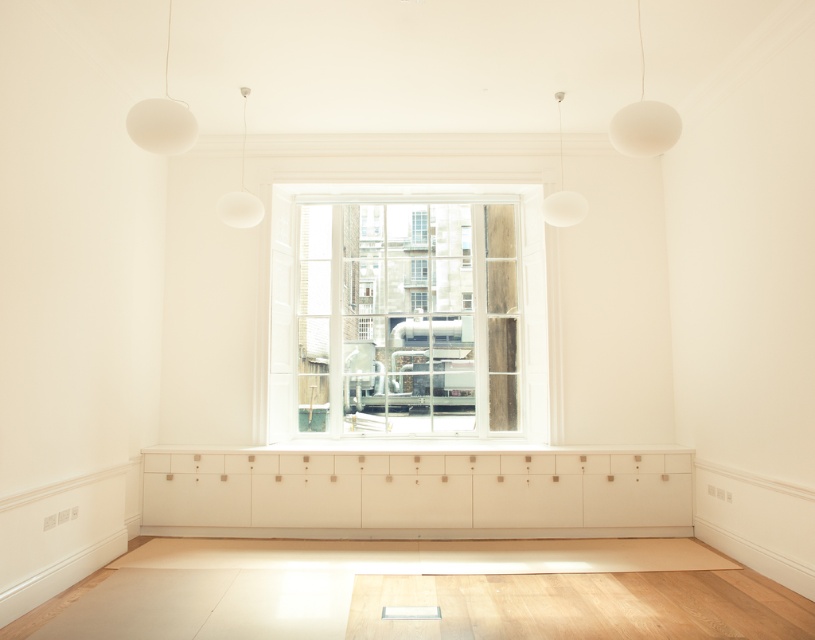
Question: Considering the real-world distances, which object is closest to the white matte pendant light at upper center?

Choices:
 (A) white matte sphere at upper right
 (B) white matte sphere at upper left
 (C) white matte cabinet at center
 (D) clear glass window at center

Answer: (B)

Question: Among these objects, which one is farthest from the camera?

Choices:
 (A) white matte sphere at upper right
 (B) white matte cabinet at center
 (C) clear glass window at center
 (D) white matte globe at upper center

Answer: (C)

Question: Where is clear glass window at center located in relation to white matte sphere at upper right in the image?

Choices:
 (A) left
 (B) right

Answer: (A)

Question: Which point is farther to the camera?

Choices:
 (A) clear glass window at center
 (B) white matte sphere at upper left
 (C) white matte cabinet at center

Answer: (A)

Question: Does white matte cabinet at center appear on the left side of white matte globe at upper center?

Choices:
 (A) no
 (B) yes

Answer: (B)

Question: Is clear glass window at center to the left of white matte cabinet at center from the viewer's perspective?

Choices:
 (A) yes
 (B) no

Answer: (A)